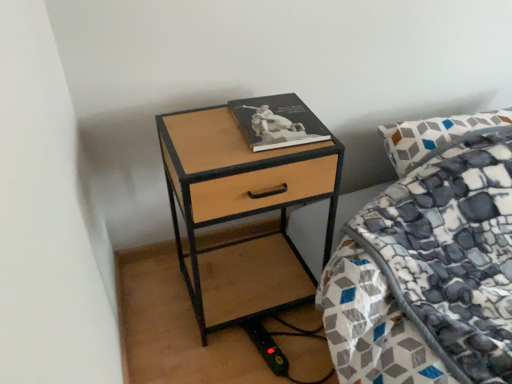
Question: Is hardcover book at upper right to the left or to the right of woodenmaterial/texturenightstand at center in the image?

Choices:
 (A) right
 (B) left

Answer: (A)

Question: Considering their positions, is hardcover book at upper right located in front of or behind woodenmaterial/texturenightstand at center?

Choices:
 (A) front
 (B) behind

Answer: (B)

Question: Is point (308, 124) positioned closer to the camera than point (309, 152)?

Choices:
 (A) closer
 (B) farther

Answer: (B)

Question: Is woodenmaterial/texturenightstand at center bigger or smaller than hardcover book at upper right?

Choices:
 (A) small
 (B) big

Answer: (B)

Question: Is point pyautogui.click(x=251, y=205) positioned closer to the camera than point pyautogui.click(x=285, y=130)?

Choices:
 (A) closer
 (B) farther

Answer: (A)

Question: From the image's perspective, is woodenmaterial/texturenightstand at center located above or below hardcover book at upper right?

Choices:
 (A) above
 (B) below

Answer: (B)

Question: Is woodenmaterial/texturenightstand at center wider or thinner than hardcover book at upper right?

Choices:
 (A) wide
 (B) thin

Answer: (A)